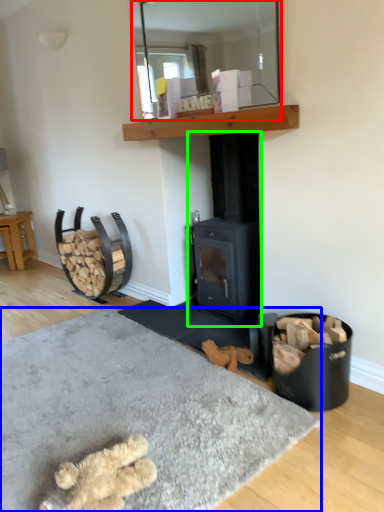
Question: Estimate the real-world distances between objects in this image. Which object is farther from mirror (highlighted by a red box), concrete (highlighted by a blue box) or wood burning stove (highlighted by a green box)?

Choices:
 (A) concrete
 (B) wood burning stove

Answer: (A)